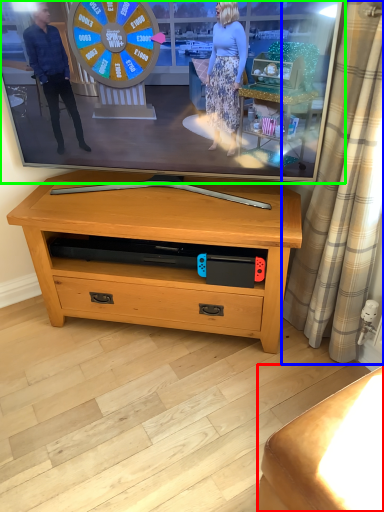
Question: Considering the real-world distances, which object is farthest from furniture (highlighted by a red box)? curtain (highlighted by a blue box) or television (highlighted by a green box)?

Choices:
 (A) curtain
 (B) television

Answer: (B)